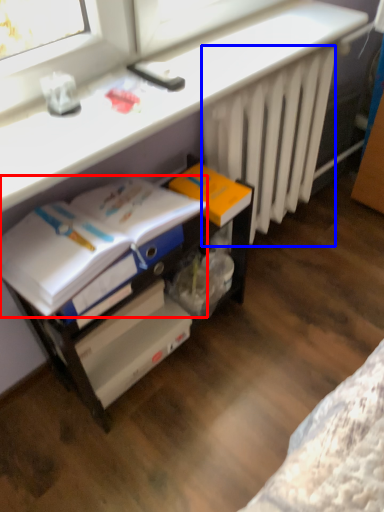
Question: Among these objects, which one is nearest to the camera, magazine (highlighted by a red box) or radiator (highlighted by a blue box)?

Choices:
 (A) magazine
 (B) radiator

Answer: (A)